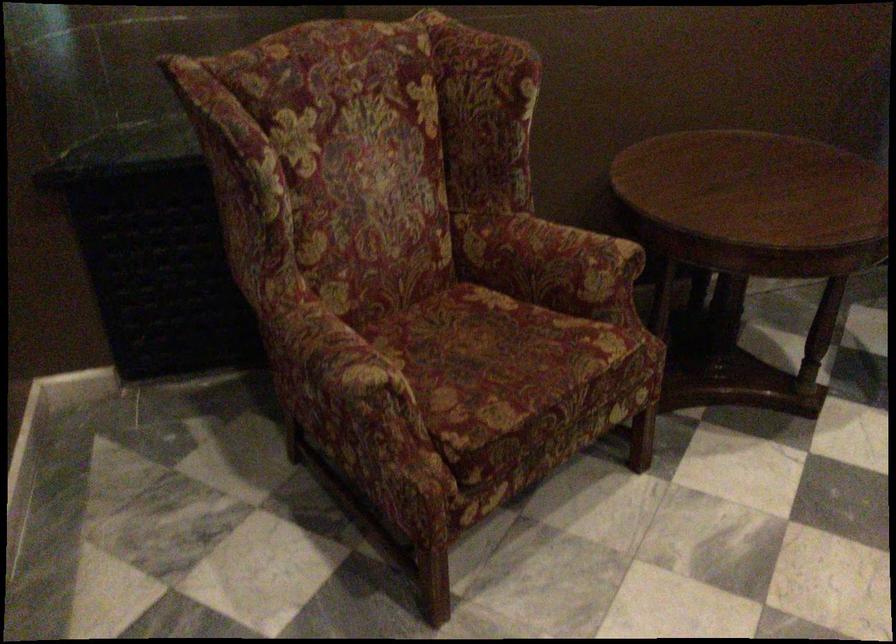
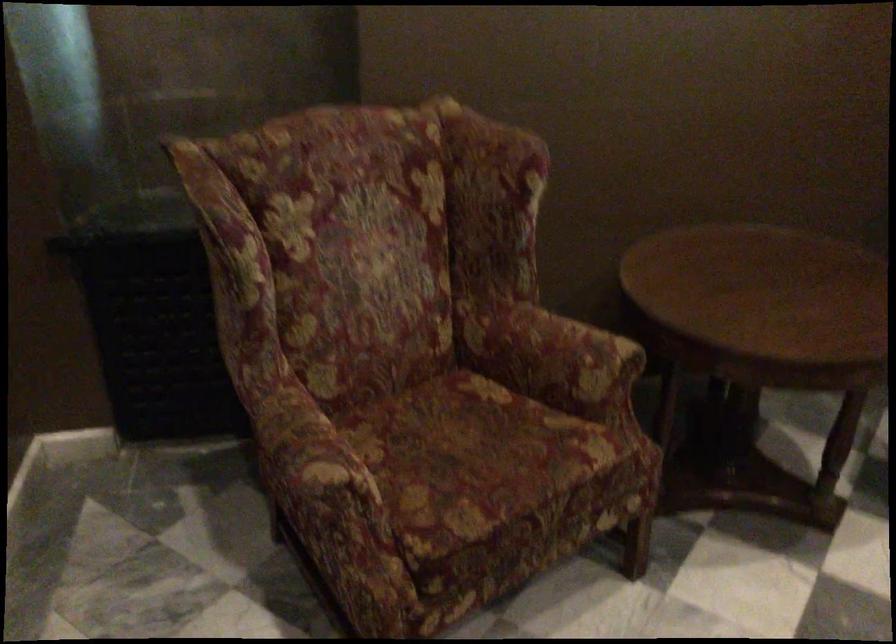
Which direction would the cameraman need to move to produce the second image?

The cameraman walked toward right, forward.